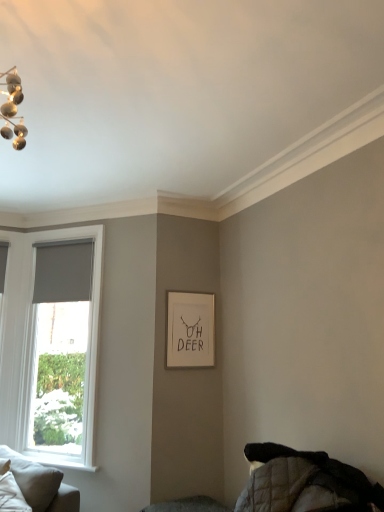
Question: Is white matte picture frame at center bigger or smaller than gray roller blind at left?

Choices:
 (A) small
 (B) big

Answer: (A)

Question: Is white matte picture frame at center spatially inside gray roller blind at left, or outside of it?

Choices:
 (A) outside
 (B) inside

Answer: (A)

Question: Which of these objects is positioned closest to the white matte picture frame at center?

Choices:
 (A) matte gray curtain at left
 (B) gray roller blind at left
 (C) white soft pillow at lower left
 (D) light gray fabric couch at lower left

Answer: (B)

Question: Estimate the real-world distances between objects in this image. Which object is farther from the light gray fabric couch at lower left?

Choices:
 (A) gray roller blind at left
 (B) white matte picture frame at center
 (C) white soft pillow at lower left
 (D) matte gray curtain at left

Answer: (D)